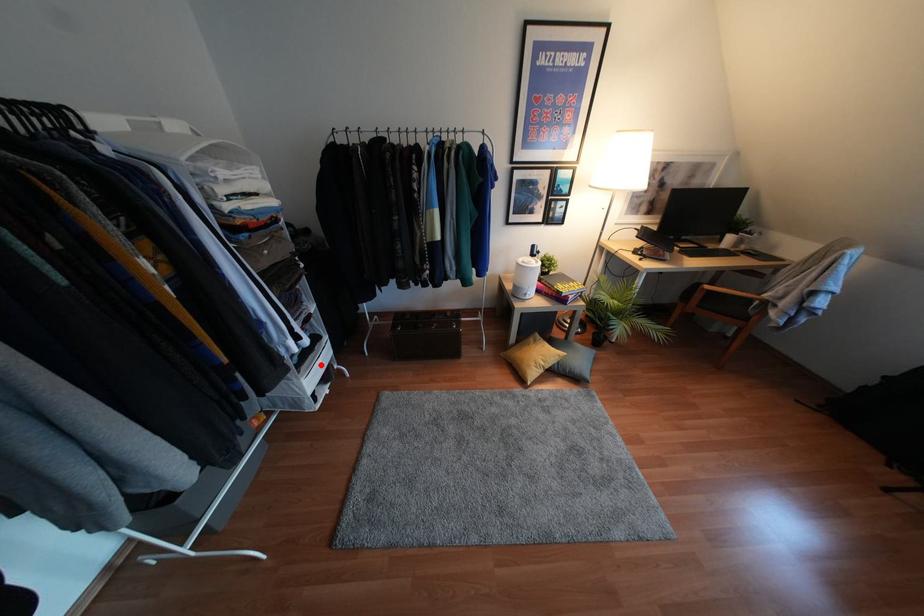
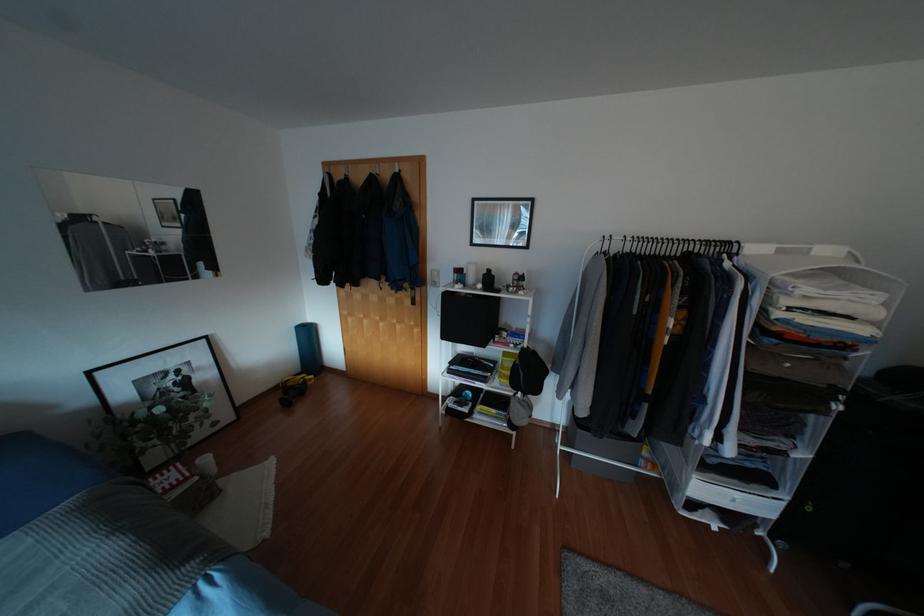
Locate, in the second image, the point that corresponds to the highlighted location in the first image.

(734, 500)